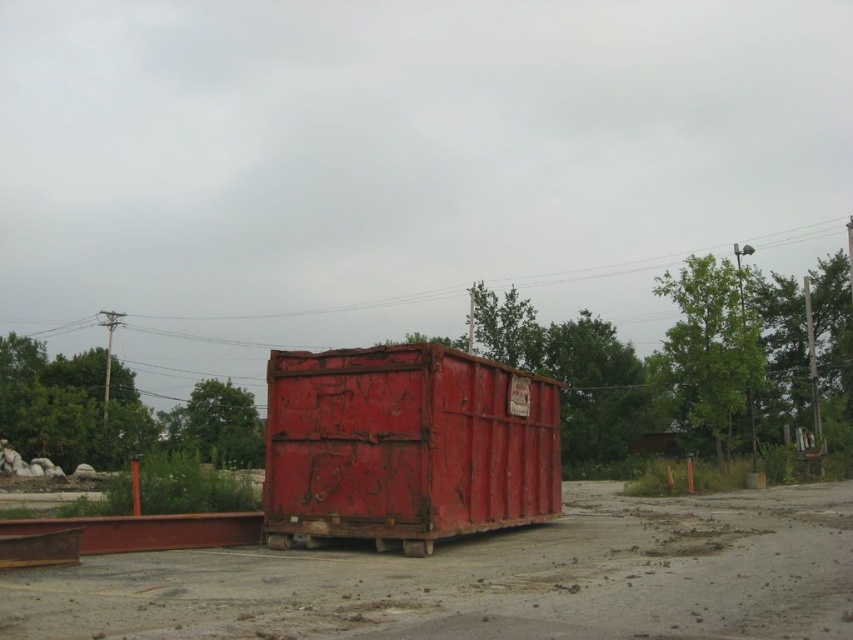
From the picture: You are a delivery driver who needs to park your truck behind the rusty metal shipping container at center. However, you notice the dull concrete dirt track at center. Is there enough space behind the container to park your truck?

The dull concrete dirt track at center is in front of the rusty metal shipping container at center, so there is space behind the container to park the truck.

You are standing at point A and want to move to the dull concrete dirt track at center. What direction should you move in?

The dull concrete dirt track at center is located at point (x=486, y=579), so you should move towards that coordinate to reach it.

You have a truck that is 10 feet wide. You want to drive it through the path between the dull concrete dirt track at center and the rusty metal shipping container at center. Can your truck fit through the path?

The dull concrete dirt track at center might be wider than the rusty metal shipping container at center, so there is a possibility that the truck can fit through the path. However, since the exact width isn not specified, it is recommended to measure the path before attempting to drive through.